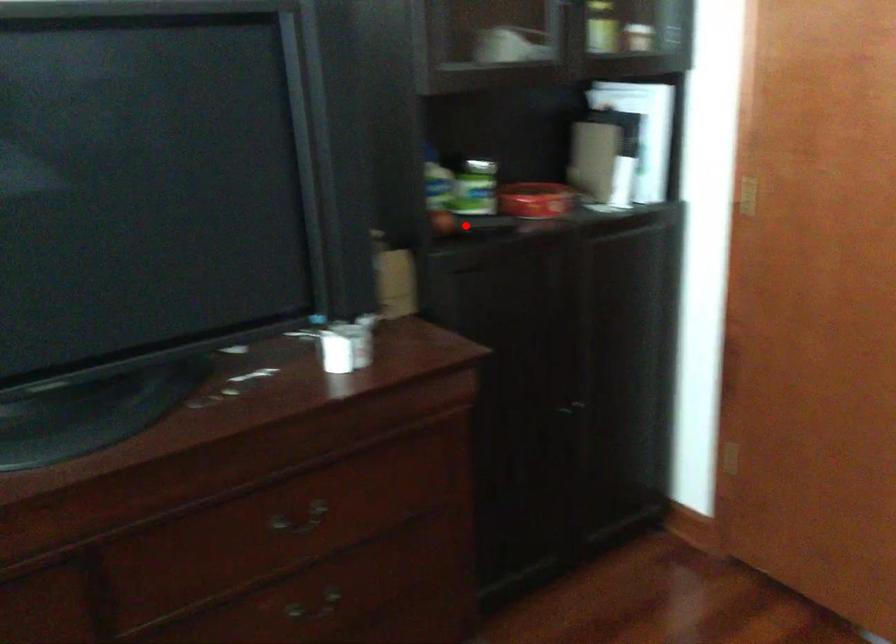
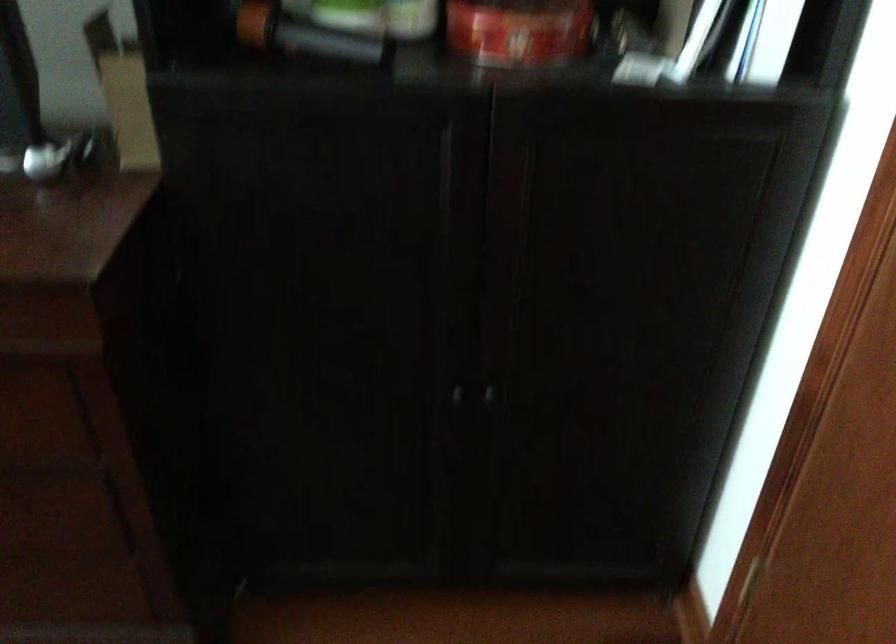
Question: I am providing you with two images of the same scene from different viewpoints. Given a red point in image1, look at the same physical point in image2. Is it:

Choices:
 (A) Closer to the viewpoint
 (B) Farther from the viewpoint

Answer: (A)